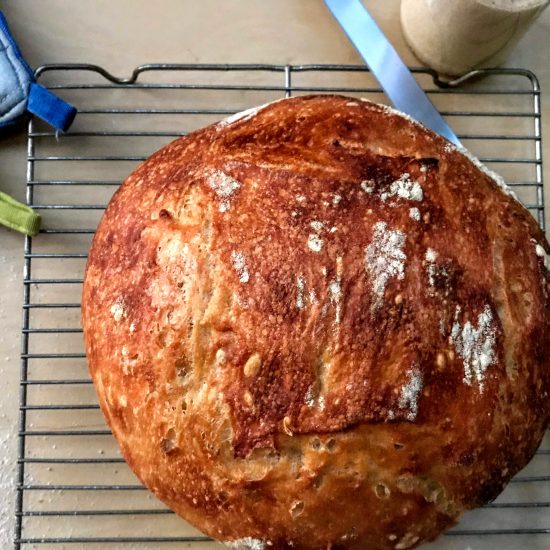
Where is `right side of rack`? The height and width of the screenshot is (550, 550). right side of rack is located at coordinates (537, 192).